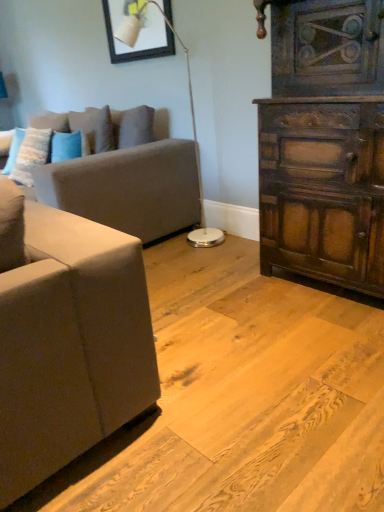
Question: In the image, is blue plush pillow at upper left, which appears as the second pillow when viewed from the left, positioned in front of or behind matte gray couch at left?

Choices:
 (A) behind
 (B) front

Answer: (A)

Question: In terms of width, does blue plush pillow at upper left, arranged as the 1th pillow when viewed from the right, look wider or thinner when compared to matte gray couch at left?

Choices:
 (A) thin
 (B) wide

Answer: (A)

Question: Estimate the real-world distances between objects in this image. Which object is closer to the white glossy floor lamp at center?

Choices:
 (A) matte gray couch at left
 (B) dark brown wood chest of drawers at right
 (C) matte black picture frame at upper center
 (D) blue plush pillow at upper left, arranged as the 1th pillow when viewed from the right
 (E) fluffy white pillow at left, which is the second pillow from right to left

Answer: (C)

Question: Which object is the farthest from the white glossy floor lamp at center?

Choices:
 (A) matte gray couch at left
 (B) blue plush pillow at upper left, arranged as the 1th pillow when viewed from the right
 (C) fluffy white pillow at left, which is the second pillow from right to left
 (D) matte black picture frame at upper center
 (E) dark brown wood chest of drawers at right

Answer: (C)